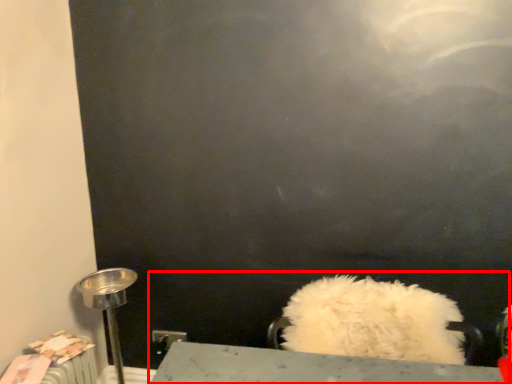
Question: From the image's perspective, what is the correct spatial positioning of sink (annotated by the red box) in reference to table lamp?

Choices:
 (A) below
 (B) above

Answer: (B)